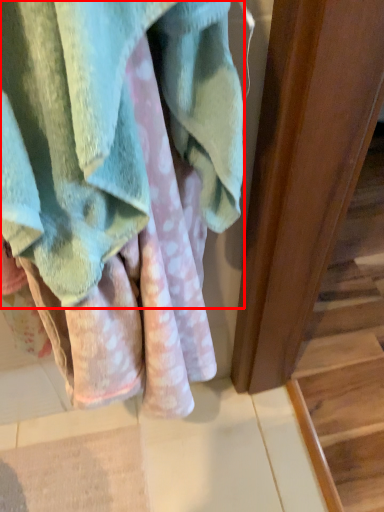
Question: From the image's perspective, what is the correct spatial relationship of towel (annotated by the red box) in relation to stairwell?

Choices:
 (A) below
 (B) above

Answer: (B)